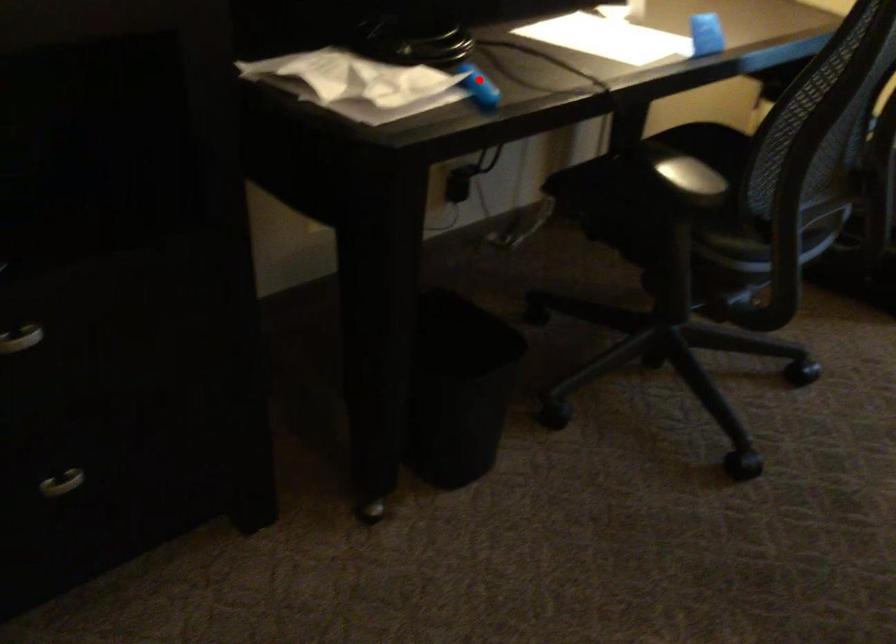
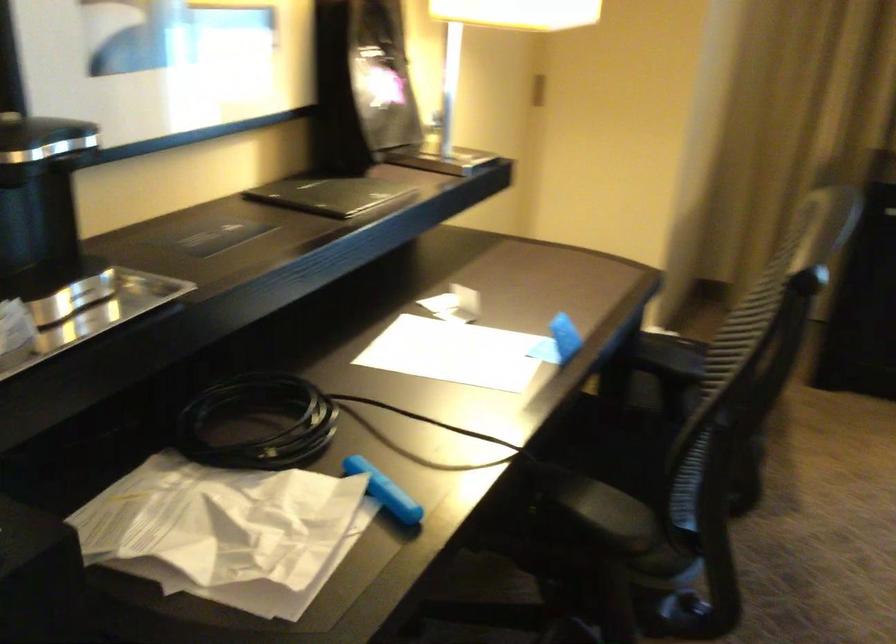
Question: A red point is marked in image1. In image2, is the corresponding 3D point closer to the camera or farther? Reply with the corresponding letter.

Choices:
 (A) The corresponding 3D point is closer.
 (B) The corresponding 3D point is farther.

Answer: (A)